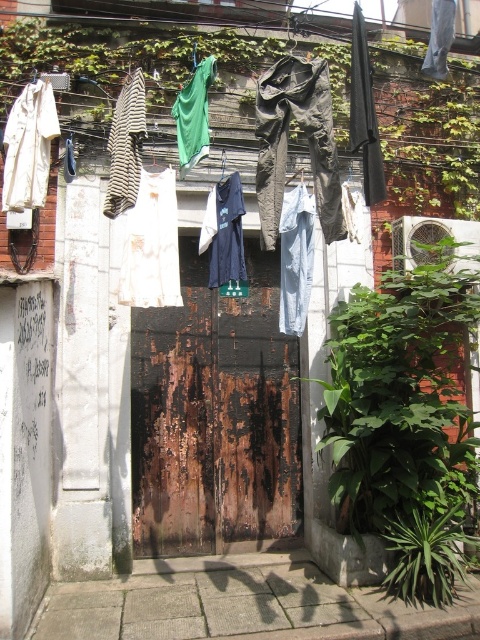
Who is more forward, (162, 252) or (140, 72)?

Point (140, 72) is more forward.

Describe the element at coordinates (152, 244) in the screenshot. I see `white cotton dress at center` at that location.

Is point (177, 218) positioned after point (141, 116)?

Yes, it is behind point (141, 116).

Where is `white cotton dress at center`? The height and width of the screenshot is (640, 480). white cotton dress at center is located at coordinates (152, 244).

Which is above, rusty wood door at center or striped fabric shirt at left?

striped fabric shirt at left is above.

Is rusty wood door at center below striped fabric shirt at left?

Yes.

Which is behind, point (271, 481) or point (106, 209)?

The point (271, 481) is more distant.

This screenshot has height=640, width=480. Identify the location of rusty wood door at center. pos(215,416).

Who is shorter, white cotton shirt at left or green fabric at center?

green fabric at center

Does white cotton shirt at left appear on the right side of green fabric at center?

No, white cotton shirt at left is not to the right of green fabric at center.

Describe the element at coordinates (28, 147) in the screenshot. Image resolution: width=480 pixels, height=640 pixels. I see `white cotton shirt at left` at that location.

Where is `white cotton shirt at left`? The width and height of the screenshot is (480, 640). white cotton shirt at left is located at coordinates (28, 147).